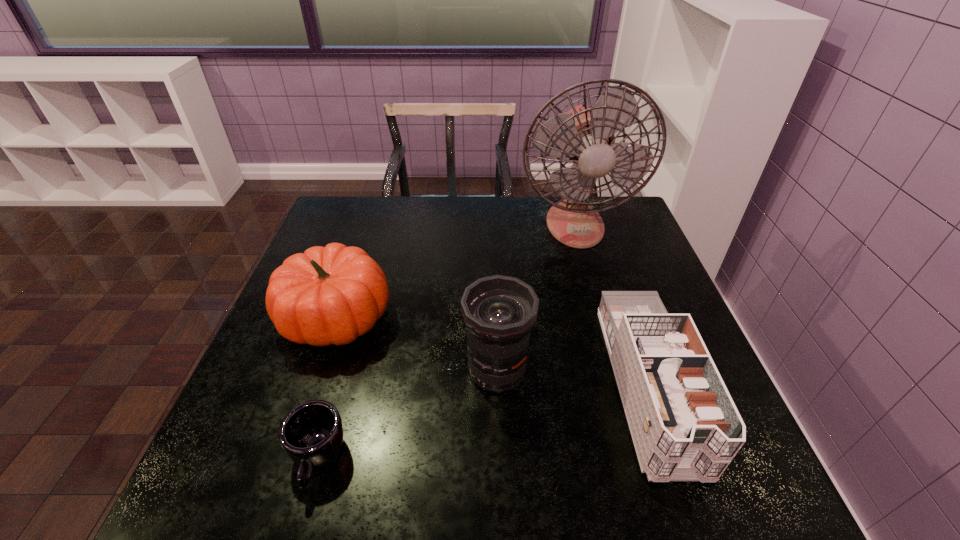
Image resolution: width=960 pixels, height=540 pixels. I want to click on dollhouse at the near edge, so click(684, 424).

This screenshot has width=960, height=540. I want to click on mug at the near edge, so click(x=311, y=434).

At what (x,y) coordinates should I click in order to perform the action: click on pumpkin at the left edge. Please return your answer as a coordinate pair (x, y). The height and width of the screenshot is (540, 960). Looking at the image, I should click on 328,295.

Where is `mug that is at the left edge`? The image size is (960, 540). mug that is at the left edge is located at coordinates (311, 434).

This screenshot has height=540, width=960. I want to click on fan at the right edge, so click(x=585, y=134).

This screenshot has height=540, width=960. In order to click on dollhouse present at the right edge in this screenshot , I will do tap(684, 424).

Locate an element on the screen. This screenshot has width=960, height=540. object at the near left corner is located at coordinates (311, 434).

Where is `object that is at the far right corner`? The width and height of the screenshot is (960, 540). object that is at the far right corner is located at coordinates (585, 134).

I want to click on object that is at the near right corner, so click(x=684, y=424).

This screenshot has height=540, width=960. In the image, there is a desktop. In order to click on free space at the far edge in this screenshot , I will do `click(397, 218)`.